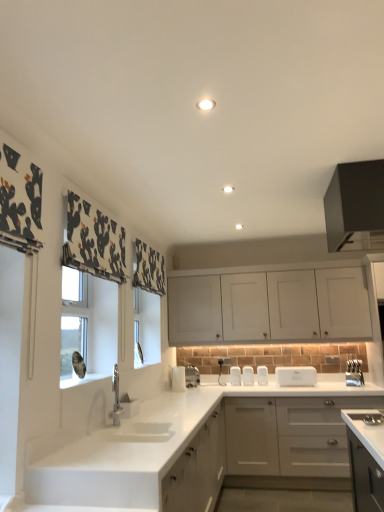
Question: Is satin nickel faucet at center, the second appliance viewed from the left, to the left or to the right of white plastic toaster at center, which is the 3th appliance from right to left, in the image?

Choices:
 (A) right
 (B) left

Answer: (B)

Question: Considering the positions of satin nickel faucet at center, the sixth appliance in the right-to-left sequence, and white plastic toaster at center, placed as the 5th appliance when sorted from left to right, in the image, is satin nickel faucet at center, the sixth appliance in the right-to-left sequence, taller or shorter than white plastic toaster at center, placed as the 5th appliance when sorted from left to right,?

Choices:
 (A) short
 (B) tall

Answer: (B)

Question: Estimate the real-world distances between objects in this image. Which object is farther from the silver metallic knife block at right, which is counted as the first appliance, starting from the right?

Choices:
 (A) black matte cabinet at upper right, positioned as the 1th cabinetry in top-to-bottom order
 (B) white matte cabinet at lower left, the 1th cabinetry positioned from the bottom
 (C) white plastic toaster at center, placed as the 5th appliance when sorted from left to right
 (D) white plastic toaster at center, acting as the 5th appliance starting from the right
 (E) white matte cabinet at upper center, which is counted as the 2th cabinetry, starting from the bottom

Answer: (A)

Question: Which object is positioned farthest from the satin nickel faucet at center, the second appliance viewed from the left?

Choices:
 (A) white plastic toaster at center, acting as the 5th appliance starting from the right
 (B) silver metallic knife block at right, placed as the 7th appliance when sorted from left to right
 (C) white matte cabinet at upper center, which is counted as the 2th cabinetry, starting from the bottom
 (D) white plastic toaster at center, which appears as the 2th appliance when viewed from the right
 (E) black matte cabinet at upper right, the third cabinetry when ordered from bottom to top

Answer: (E)